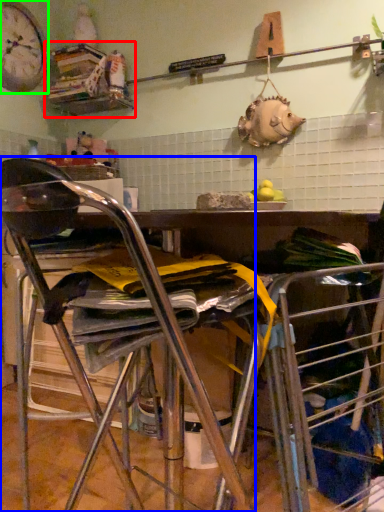
Question: Which is nearer to the shelf (highlighted by a red box)? chair (highlighted by a blue box) or clock (highlighted by a green box).

Choices:
 (A) chair
 (B) clock

Answer: (B)